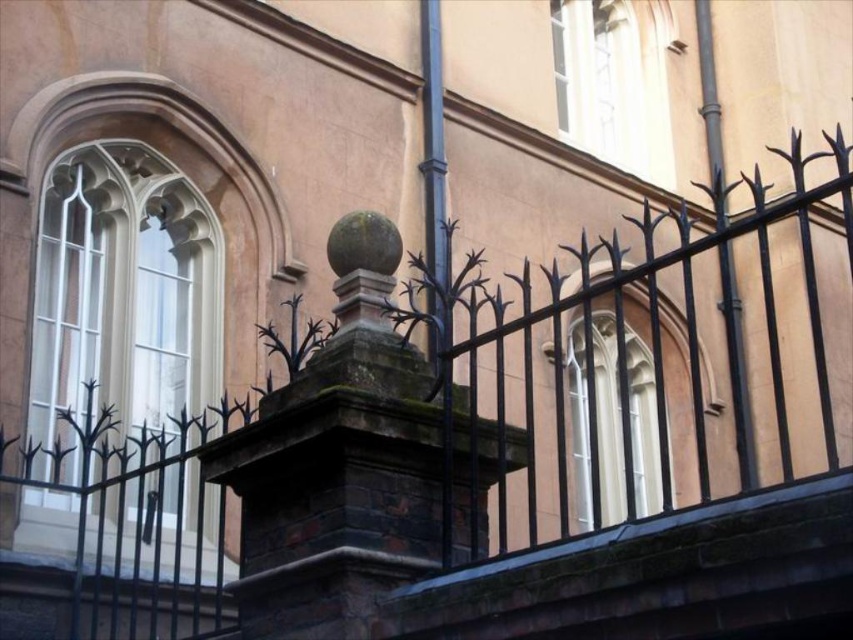
You are standing at the base of the smooth metal pole at right and want to walk directly to the white glass window at upper left. Given that the distance between them is 61.13 feet, how many steps would you need to take if each step covers approximately 2.5 feet?

To determine the number of steps needed to cover 61.13 feet with each step being 2.5 feet, divide the total distance by the step length. 61.13 divided by 2.5 equals approximately 24.45 steps. Since you can only take whole steps, you would need to take 25 steps to reach the white glass window at upper left from the smooth metal pole at right.

What are the coordinates of the clear glass window at center?

The clear glass window at center is located at coordinates point (613,420).

You are a maintenance worker needing to move a 6 meter long ladder from the clear glass window at center to the smooth metal pole at right. Can you move the ladder horizontally between them without tilting it?

The clear glass window at center and smooth metal pole at right are 6.19 meters apart from each other. Since the ladder is 6 meters long, which is shorter than the distance between them, the ladder cannot be moved horizontally between them without tilting.